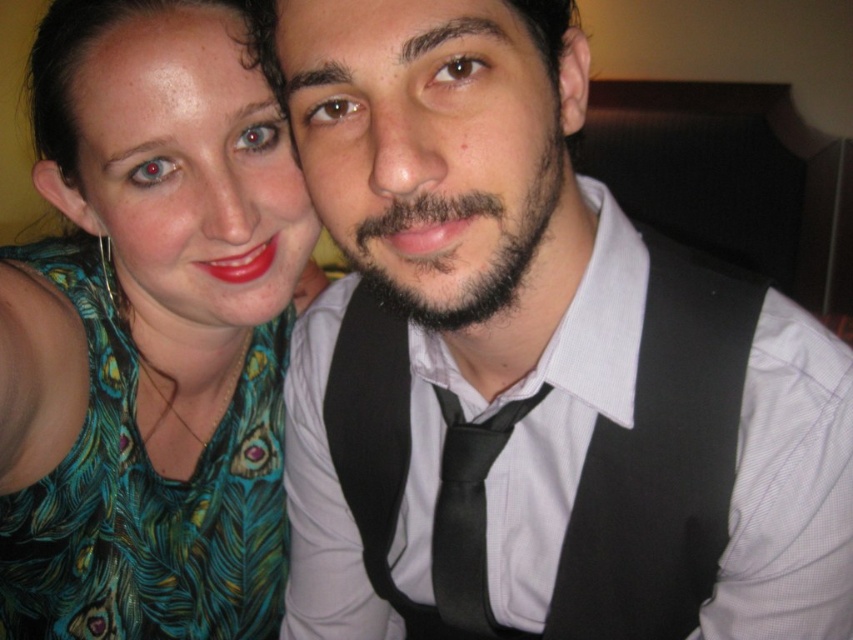
Question: Estimate the real-world distances between objects in this image. Which object is closer to the green feathered dress at left?

Choices:
 (A) black satin tie at center
 (B) black fabric vest at center

Answer: (B)

Question: Considering the real-world distances, which object is closest to the black satin tie at center?

Choices:
 (A) black fabric vest at center
 (B) green feathered dress at left

Answer: (A)

Question: Does black fabric vest at center have a lesser width compared to black satin tie at center?

Choices:
 (A) no
 (B) yes

Answer: (A)

Question: Observing the image, what is the correct spatial positioning of green feathered dress at left in reference to black fabric vest at center?

Choices:
 (A) below
 (B) above

Answer: (B)

Question: Can you confirm if black fabric vest at center is positioned above black satin tie at center?

Choices:
 (A) yes
 (B) no

Answer: (A)

Question: Among these points, which one is farthest from the camera?

Choices:
 (A) (451, 602)
 (B) (71, 301)
 (C) (688, 515)

Answer: (B)